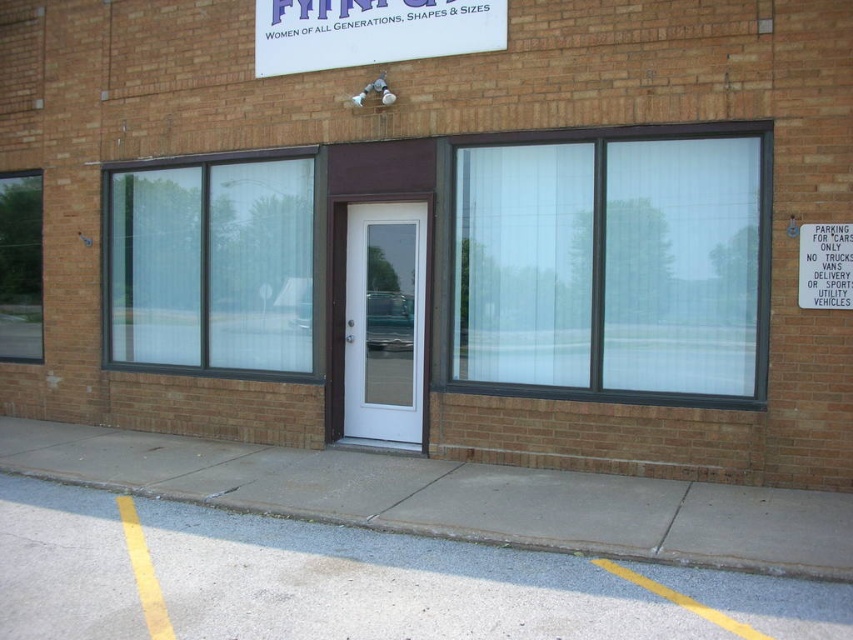
Does gray concrete pavement at lower left come behind gray concrete sidewalk at lower center?

No, it is in front of gray concrete sidewalk at lower center.

Which is in front, point (160, 547) or point (83, 449)?

Point (160, 547)

Between point (589, 586) and point (233, 492), which one is positioned in front?

Point (589, 586)

The height and width of the screenshot is (640, 853). In order to click on gray concrete pavement at lower left in this screenshot , I will do `click(450, 588)`.

From the picture: Is white plastic sign at upper center taller than white paper sign at right?

Yes, white plastic sign at upper center is taller than white paper sign at right.

Can you confirm if white plastic sign at upper center is shorter than white paper sign at right?

No.

This screenshot has height=640, width=853. What do you see at coordinates (370, 32) in the screenshot?
I see `white plastic sign at upper center` at bounding box center [370, 32].

Identify the location of white plastic sign at upper center. (x=370, y=32).

Does clear glass window at right appear on the left side of clear glass window at center?

No, clear glass window at right is not to the left of clear glass window at center.

Between clear glass window at right and clear glass window at center, which one is positioned higher?

clear glass window at center

Locate an element on the screen. This screenshot has width=853, height=640. clear glass window at right is located at coordinates (612, 264).